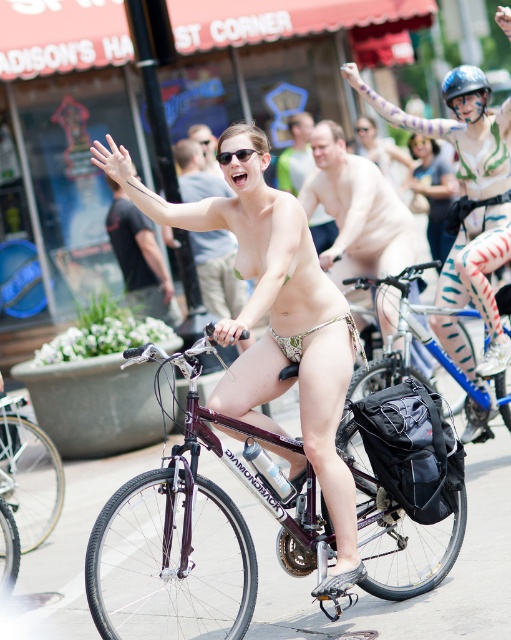
Question: Does smooth beige skin at center have a lesser width compared to shiny metallic bicycle at center?

Choices:
 (A) no
 (B) yes

Answer: (B)

Question: Is silver metallic bicycle at center positioned behind blue matte helmet at upper right?

Choices:
 (A) no
 (B) yes

Answer: (A)

Question: Considering the real-world distances, which object is closest to the blue matte helmet at upper right?

Choices:
 (A) smooth skin man at center
 (B) metallic silver bicycle at center

Answer: (B)

Question: Which is nearer to the black plastic sunglasses at center?

Choices:
 (A) matte gold bikini at center
 (B) blue matte helmet at upper right

Answer: (B)

Question: Estimate the real-world distances between objects in this image. Which object is closer to the metallic silver bicycle at center?

Choices:
 (A) smooth beige shorts at center
 (B) silver metallic bicycle at center
 (C) shiny metallic bicycle at center
 (D) metallic purple bicycle at center

Answer: (D)

Question: Is smooth beige skin at center behind shiny metallic bicycle at center?

Choices:
 (A) no
 (B) yes

Answer: (B)